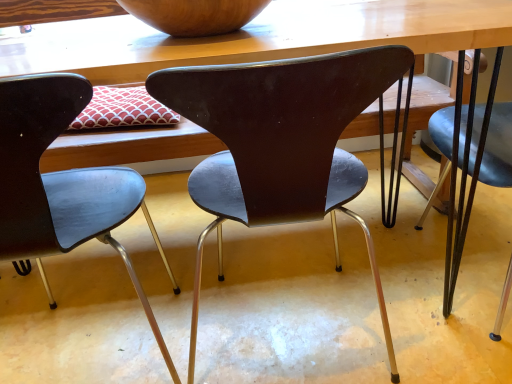
Question: Can you confirm if matte black chair at center, which is the 1th chair from left to right, is shorter than wooden bowl at upper center?

Choices:
 (A) yes
 (B) no

Answer: (B)

Question: Is matte black chair at center, the 2th chair positioned from the right, outside wooden bowl at upper center?

Choices:
 (A) yes
 (B) no

Answer: (A)

Question: Considering the relative positions of matte black chair at center, the 2th chair positioned from the right, and wooden bowl at upper center in the image provided, is matte black chair at center, the 2th chair positioned from the right, in front of wooden bowl at upper center?

Choices:
 (A) yes
 (B) no

Answer: (A)

Question: Would you say matte black chair at center, the 2th chair positioned from the right, contains wooden bowl at upper center?

Choices:
 (A) yes
 (B) no

Answer: (B)

Question: From the image's perspective, is matte black chair at center, the 2th chair positioned from the right, above wooden bowl at upper center?

Choices:
 (A) no
 (B) yes

Answer: (A)

Question: Is point (230, 3) positioned closer to the camera than point (291, 157)?

Choices:
 (A) closer
 (B) farther

Answer: (B)

Question: Is wooden bowl at upper center situated inside matte black chair at center, positioned as the first chair in right-to-left order, or outside?

Choices:
 (A) outside
 (B) inside

Answer: (A)

Question: From the image's perspective, relative to matte black chair at center, positioned as the first chair in right-to-left order, is wooden bowl at upper center above or below?

Choices:
 (A) above
 (B) below

Answer: (A)

Question: Is wooden bowl at upper center bigger or smaller than matte black chair at center, positioned as the 2th chair in left-to-right order?

Choices:
 (A) big
 (B) small

Answer: (B)

Question: From a real-world perspective, is wooden bowl at upper center physically located above or below wooden table at center?

Choices:
 (A) below
 (B) above

Answer: (B)

Question: In terms of width, does wooden bowl at upper center look wider or thinner when compared to wooden table at center?

Choices:
 (A) wide
 (B) thin

Answer: (B)

Question: Would you say wooden bowl at upper center is to the left or to the right of wooden table at center in the picture?

Choices:
 (A) right
 (B) left

Answer: (B)

Question: Considering their positions, is wooden bowl at upper center located in front of or behind wooden table at center?

Choices:
 (A) front
 (B) behind

Answer: (B)

Question: In terms of height, does wooden bowl at upper center look taller or shorter compared to matte black chair at center, the 2th chair positioned from the right?

Choices:
 (A) tall
 (B) short

Answer: (B)

Question: Is wooden bowl at upper center inside the boundaries of matte black chair at center, the 2th chair positioned from the right, or outside?

Choices:
 (A) outside
 (B) inside

Answer: (A)